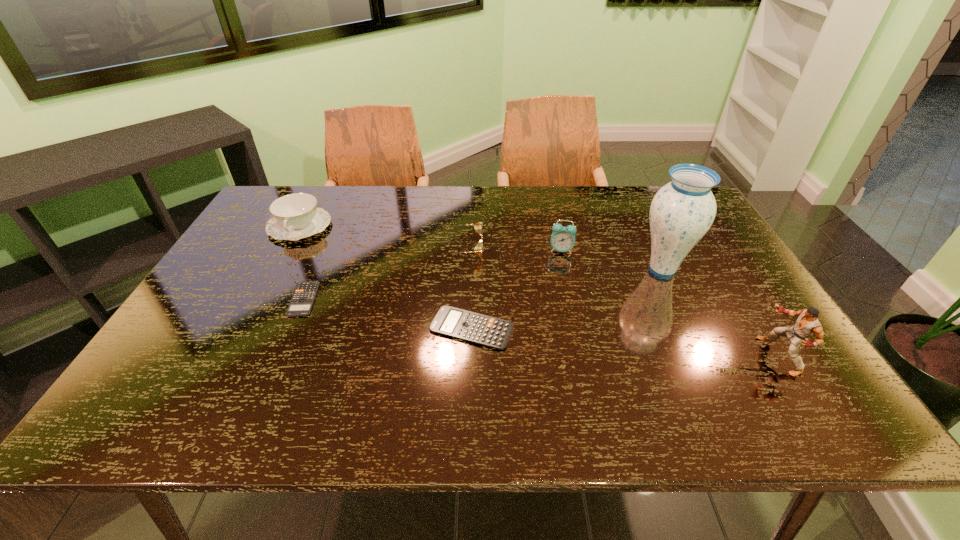
You are a GUI agent. You are given a task and a screenshot of the screen. Output one action in this format:
    pyautogui.click(x=<x>, y=<y>)
    Task: Click on the empty location between the rightmost object and the taller calculator
    
    Given the screenshot: What is the action you would take?
    pyautogui.click(x=625, y=342)

I want to click on free point between the shorter calculator and the chinaware, so click(x=301, y=263).

This screenshot has width=960, height=540. In order to click on vacant area that lies between the chinaware and the taller calculator in this screenshot , I will do `click(386, 277)`.

Where is `object identified as the third closest to the third object from right to left`? The image size is (960, 540). object identified as the third closest to the third object from right to left is located at coordinates (485, 330).

You are a GUI agent. You are given a task and a screenshot of the screen. Output one action in this format:
    pyautogui.click(x=<x>, y=<y>)
    Task: Click on the object that can be found as the third closest to the vase
    
    Given the screenshot: What is the action you would take?
    pyautogui.click(x=485, y=330)

The image size is (960, 540). Find the location of `free space that satisfies the following two spatial constraints: 1. on the handle side of the shorter calculator; 2. on the left side of the chinaware`. free space that satisfies the following two spatial constraints: 1. on the handle side of the shorter calculator; 2. on the left side of the chinaware is located at coordinates (260, 299).

You are a GUI agent. You are given a task and a screenshot of the screen. Output one action in this format:
    pyautogui.click(x=<x>, y=<y>)
    Task: Click on the vacant space that satisfies the following two spatial constraints: 1. on the handle side of the shortest object; 2. on the left side of the chinaware
    
    Given the screenshot: What is the action you would take?
    pyautogui.click(x=260, y=299)